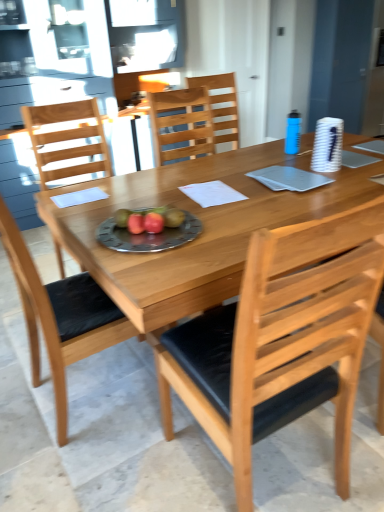
Question: From the image's perspective, would you say light brown wood chair at center, which appears as the 2th chair when viewed from the back, is shown under red matte apple at center, placed as the 1th fruit when sorted from right to left?

Choices:
 (A) no
 (B) yes

Answer: (A)

Question: Is light brown wood chair at center, placed as the 3th chair when sorted from front to back, positioned beyond the bounds of red matte apple at center, which is the 2th fruit in left-to-right order?

Choices:
 (A) yes
 (B) no

Answer: (A)

Question: Is light brown wood chair at center, which appears as the 2th chair when viewed from the back, further to the viewer compared to red matte apple at center, which is the 2th fruit in left-to-right order?

Choices:
 (A) no
 (B) yes

Answer: (B)

Question: Would you say light brown wood chair at center, placed as the 3th chair when sorted from front to back, contains red matte apple at center, placed as the 1th fruit when sorted from right to left?

Choices:
 (A) no
 (B) yes

Answer: (A)

Question: Would you say light brown wood chair at center, which appears as the 2th chair when viewed from the back, is a long distance from red matte apple at center, placed as the 1th fruit when sorted from right to left?

Choices:
 (A) no
 (B) yes

Answer: (B)

Question: From the image's perspective, does light brown wood chair at center, which appears as the 2th chair when viewed from the back, appear higher than red matte apple at center, which is the 2th fruit in left-to-right order?

Choices:
 (A) yes
 (B) no

Answer: (A)

Question: Is metallic silver plate with fruits at center not within red matte apple at center, which is the 2th fruit in left-to-right order?

Choices:
 (A) yes
 (B) no

Answer: (A)

Question: Is metallic silver plate with fruits at center to the right of red matte apple at center, which is the 2th fruit in left-to-right order, from the viewer's perspective?

Choices:
 (A) no
 (B) yes

Answer: (A)

Question: Is the depth of metallic silver plate with fruits at center greater than that of red matte apple at center, placed as the 1th fruit when sorted from right to left?

Choices:
 (A) yes
 (B) no

Answer: (B)

Question: Is metallic silver plate with fruits at center not near red matte apple at center, placed as the 1th fruit when sorted from right to left?

Choices:
 (A) yes
 (B) no

Answer: (B)

Question: From the image's perspective, is metallic silver plate with fruits at center located above red matte apple at center, which is the 2th fruit in left-to-right order?

Choices:
 (A) yes
 (B) no

Answer: (B)

Question: From a real-world perspective, does metallic silver plate with fruits at center stand above red matte apple at center, which is the 2th fruit in left-to-right order?

Choices:
 (A) yes
 (B) no

Answer: (B)

Question: Is light brown wood chair at center, which appears as the 2th chair when viewed from the back, far away from red matte apple at center, placed as the second fruit when sorted from right to left?

Choices:
 (A) yes
 (B) no

Answer: (A)